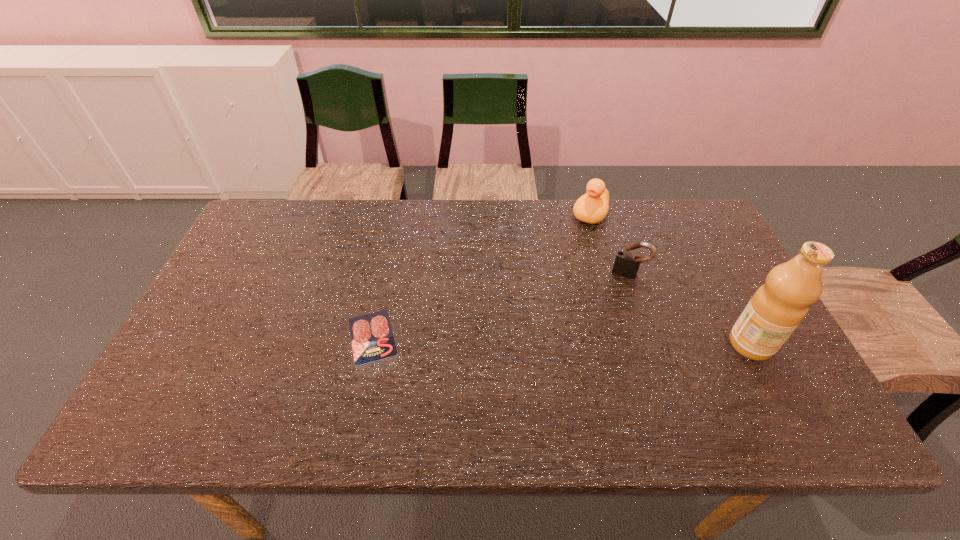
Find the location of `the shortest object`. the shortest object is located at coordinates (372, 339).

Find the location of a particular element. The image size is (960, 540). the leftmost object is located at coordinates (372, 339).

This screenshot has width=960, height=540. What are the coordinates of `olive oil` in the screenshot? It's located at 775,310.

You are a GUI agent. You are given a task and a screenshot of the screen. Output one action in this format:
    pyautogui.click(x=<x>, y=<y>)
    Task: Click on the tallest object
    Image resolution: width=960 pixels, height=540 pixels.
    Given the screenshot: What is the action you would take?
    tap(775, 310)

Locate an element on the screen. The image size is (960, 540). padlock is located at coordinates (626, 264).

Where is `duck`? The height and width of the screenshot is (540, 960). duck is located at coordinates (592, 207).

Where is `blank area located on the back of the leftmost object`? The width and height of the screenshot is (960, 540). blank area located on the back of the leftmost object is located at coordinates (396, 220).

The width and height of the screenshot is (960, 540). I want to click on free space located with the keyhole on the front of the third nearest object, so click(x=610, y=323).

Identify the location of free location located with the keyhole on the front of the third nearest object. (602, 347).

Locate an element on the screen. The height and width of the screenshot is (540, 960). vacant space situated with the keyhole on the front of the third nearest object is located at coordinates (601, 349).